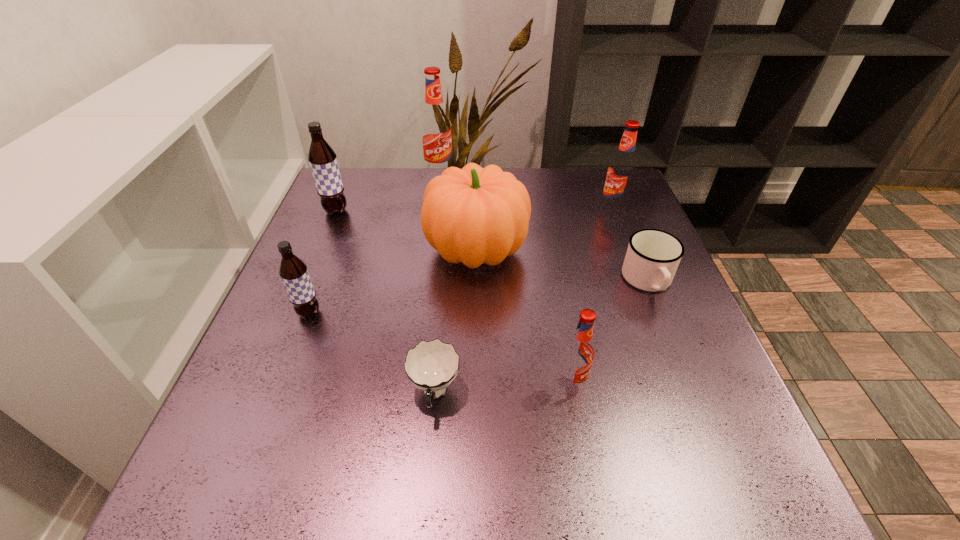
The width and height of the screenshot is (960, 540). I want to click on mug, so click(652, 258).

The width and height of the screenshot is (960, 540). What are the coordinates of `cup` in the screenshot? It's located at (431, 366).

Locate an element on the screen. the shortest object is located at coordinates (431, 366).

This screenshot has width=960, height=540. I want to click on vacant region located on the right of the third root beer from right to left, so click(480, 174).

The height and width of the screenshot is (540, 960). Find the location of `free space located on the front of the rightmost root beer`. free space located on the front of the rightmost root beer is located at coordinates (632, 259).

The width and height of the screenshot is (960, 540). Identify the location of free region located 0.130m on the front of the farther brown root beer. (320, 251).

The height and width of the screenshot is (540, 960). In order to click on vacant space located 0.380m on the front of the pumpkin in this screenshot , I will do `click(475, 459)`.

Identify the location of vacant area situated on the back of the second nearest root beer. This screenshot has width=960, height=540. (322, 281).

In order to click on vacant region located 0.220m on the right of the fourth root beer from left to right in this screenshot , I will do `click(711, 383)`.

You are a GUI agent. You are given a task and a screenshot of the screen. Output one action in this format:
    pyautogui.click(x=<x>, y=<y>)
    Task: Click on the free space located 0.350m on the side of the mug with the handle
    
    Given the screenshot: What is the action you would take?
    pyautogui.click(x=727, y=477)